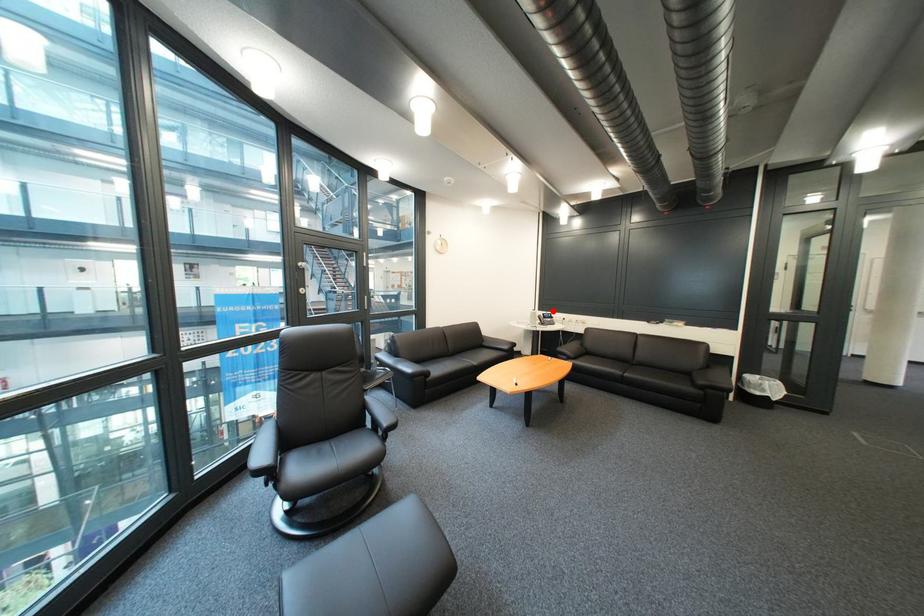
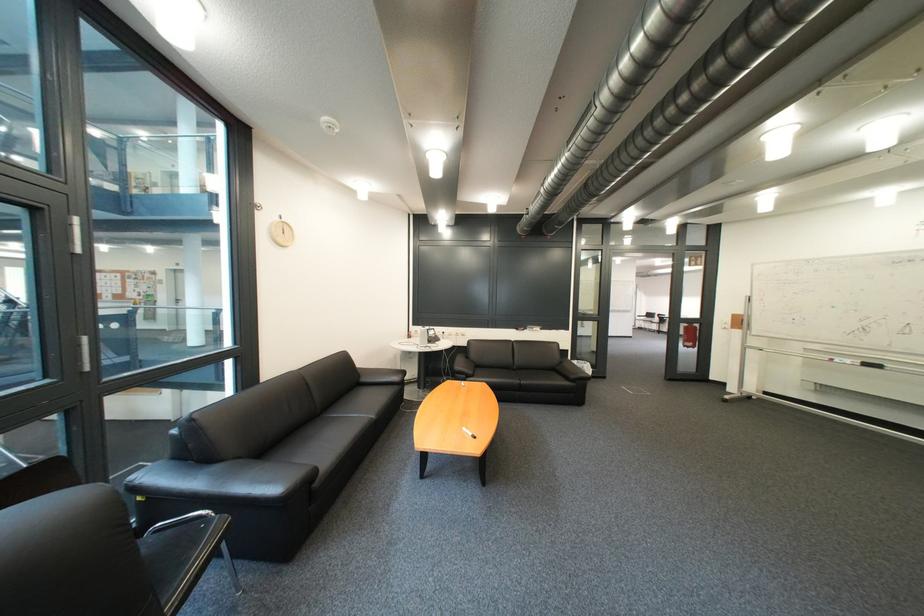
Find the pixel in the second image that matches the highlighted location in the first image.

(428, 326)